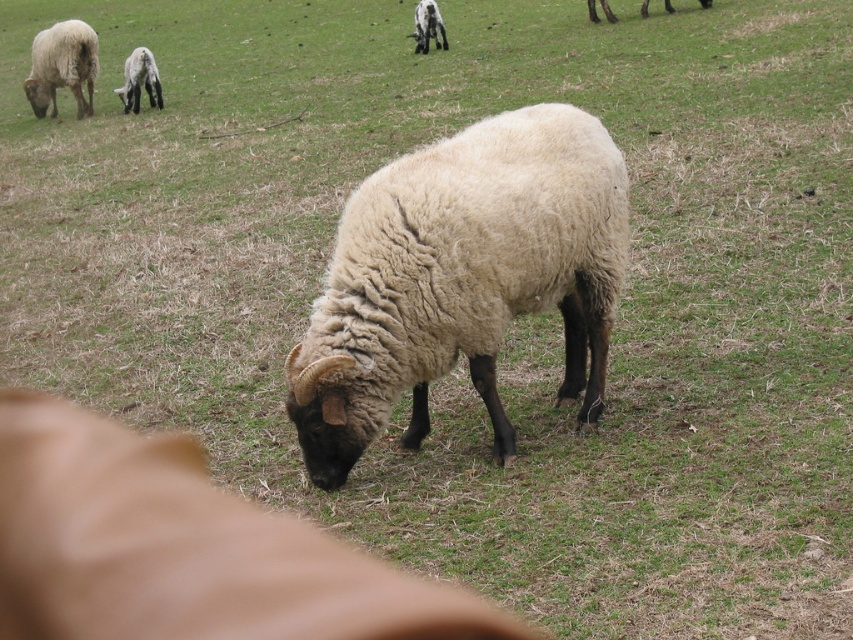
Question: Does fluffy woolen sheep at center appear under white woolen sheep at upper left?

Choices:
 (A) yes
 (B) no

Answer: (A)

Question: Is white woolen sheep at upper left to the left of white woolen sheep at center from the viewer's perspective?

Choices:
 (A) yes
 (B) no

Answer: (A)

Question: Which point is closer to the camera?

Choices:
 (A) (376, 340)
 (B) (33, 106)
 (C) (234, 508)
 (D) (416, 17)

Answer: (C)

Question: Does fluffy woolen sheep at center appear over white woolly sheep at upper left?

Choices:
 (A) yes
 (B) no

Answer: (B)

Question: Which object appears closest to the camera in this image?

Choices:
 (A) smooth leather dog at center
 (B) fluffy woolen sheep at center
 (C) white woolen sheep at upper left
 (D) white woolly sheep at upper left

Answer: (A)

Question: Which is nearer to the fluffy woolen sheep at center?

Choices:
 (A) white woolen sheep at upper left
 (B) smooth leather dog at center
 (C) white woolen sheep at center

Answer: (B)